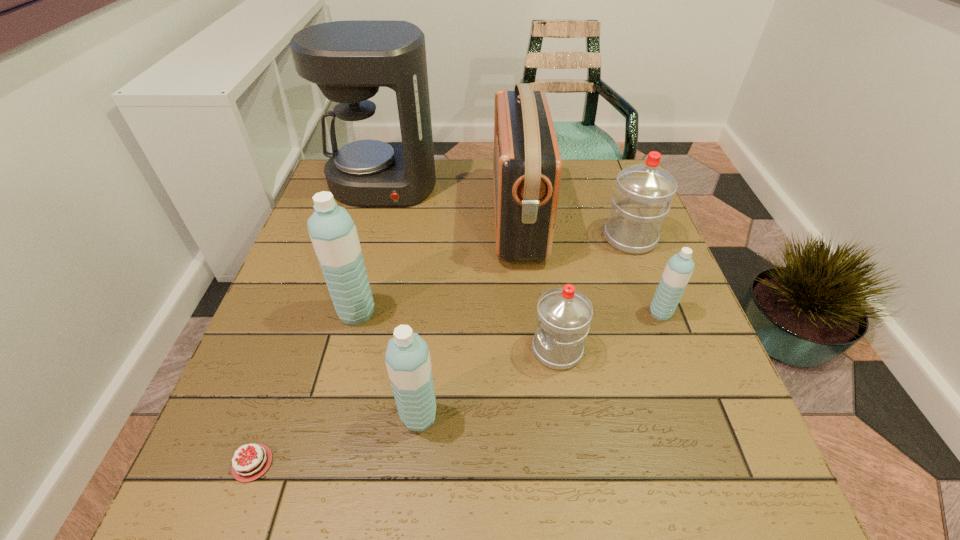
This screenshot has height=540, width=960. Find the location of `free point between the fourth water bottle from right to left and the radio receiver`. free point between the fourth water bottle from right to left and the radio receiver is located at coordinates (468, 318).

Locate an element on the screen. This screenshot has height=540, width=960. unoccupied area between the dark coffee maker and the red chocolate cake is located at coordinates (318, 324).

Image resolution: width=960 pixels, height=540 pixels. What are the coordinates of `free space between the third water bottle from left to right and the nearest water bottle` in the screenshot? It's located at 488,383.

Locate an element on the screen. Image resolution: width=960 pixels, height=540 pixels. free space between the dark coffee maker and the tallest water bottle is located at coordinates (370, 249).

I want to click on vacant area that lies between the second smallest blue water bottle and the farther white water bottle, so click(524, 327).

You are a GUI agent. You are given a task and a screenshot of the screen. Output one action in this format:
    pyautogui.click(x=<x>, y=<y>)
    Task: Click on the free space between the nearer white water bottle and the right white water bottle
    The image size is (960, 540).
    Given the screenshot: What is the action you would take?
    pyautogui.click(x=593, y=294)

Locate an element on the screen. unoccupied area between the chocolate cake and the leftmost blue water bottle is located at coordinates (304, 388).

Identify the location of blank region between the tallest water bottle and the radio receiver. (437, 266).

Find the location of a particular element. This screenshot has height=540, width=960. object that can be found as the fourth closest to the leftmost water bottle is located at coordinates (564, 314).

Locate which object is the fourth closest to the tallest water bottle. Please provide its 2D coordinates. Your answer should be formatted as a tuple, i.e. [(x, y)], where the tuple contains the x and y coordinates of a point satisfying the conditions above.

[(564, 314)]